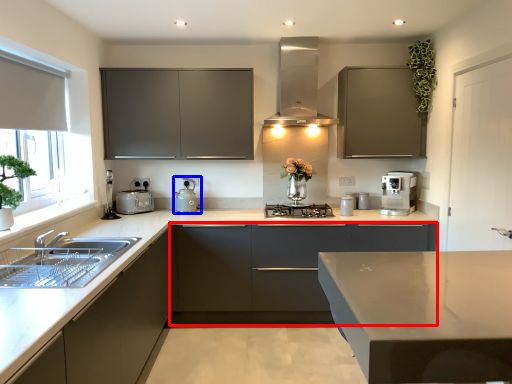
Question: Which object appears farthest to the camera in this image, cabinetry (highlighted by a red box) or appliance (highlighted by a blue box)?

Choices:
 (A) cabinetry
 (B) appliance

Answer: (B)